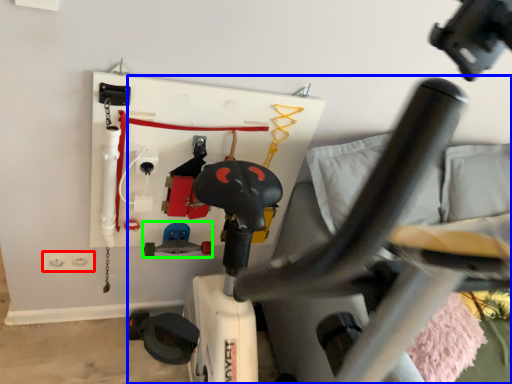
Question: Which object is positioned farthest from electric outlet (highlighted by a red box)? Select from swivel chair (highlighted by a blue box) and toy (highlighted by a green box).

Choices:
 (A) swivel chair
 (B) toy

Answer: (A)